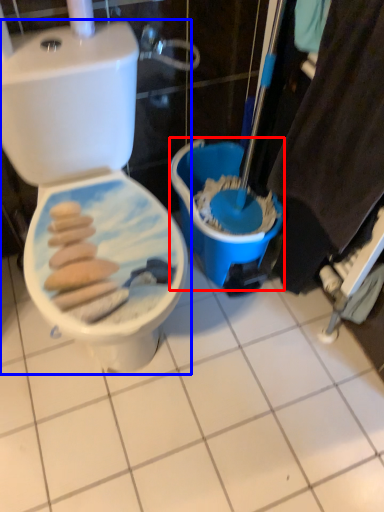
Question: Which point is closer to the camera, potty (highlighted by a red box) or toilet (highlighted by a blue box)?

Choices:
 (A) potty
 (B) toilet

Answer: (B)